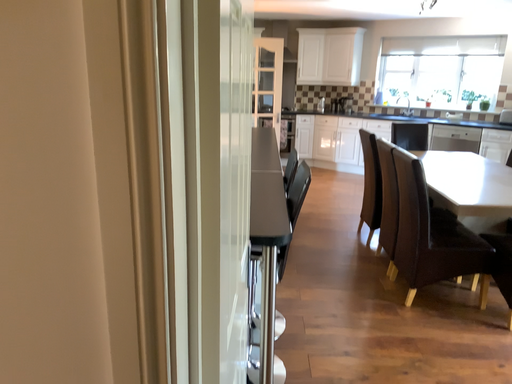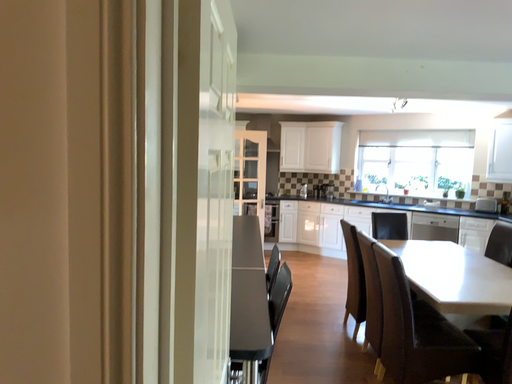
Question: How did the camera likely rotate when shooting the video?

Choices:
 (A) rotated downward
 (B) rotated upward

Answer: (B)